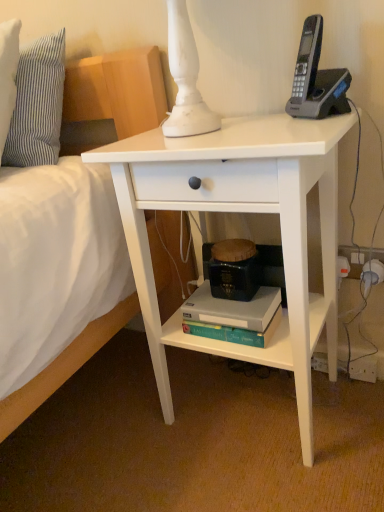
Question: From a real-world perspective, is black plastic phone at upper right under striped fabric pillow at upper left?

Choices:
 (A) no
 (B) yes

Answer: (B)

Question: From the image's perspective, would you say black plastic phone at upper right is positioned over striped fabric pillow at upper left?

Choices:
 (A) no
 (B) yes

Answer: (A)

Question: Is black plastic phone at upper right bigger than striped fabric pillow at upper left?

Choices:
 (A) yes
 (B) no

Answer: (B)

Question: From the image's perspective, is black plastic phone at upper right located beneath striped fabric pillow at upper left?

Choices:
 (A) yes
 (B) no

Answer: (A)

Question: Does black plastic phone at upper right appear on the left side of striped fabric pillow at upper left?

Choices:
 (A) yes
 (B) no

Answer: (B)

Question: Is point (261, 181) closer or farther from the camera than point (41, 133)?

Choices:
 (A) closer
 (B) farther

Answer: (A)

Question: Relative to striped fabric pillow at upper left, is white matte desk at center in front or behind?

Choices:
 (A) behind
 (B) front

Answer: (B)

Question: From a real-world perspective, is white matte desk at center above or below striped fabric pillow at upper left?

Choices:
 (A) below
 (B) above

Answer: (A)

Question: Is white matte desk at center bigger or smaller than striped fabric pillow at upper left?

Choices:
 (A) small
 (B) big

Answer: (B)

Question: Is black plastic phone at upper right in front of or behind teal matte paperback book at lower center in the image?

Choices:
 (A) front
 (B) behind

Answer: (A)

Question: In terms of width, does black plastic phone at upper right look wider or thinner when compared to teal matte paperback book at lower center?

Choices:
 (A) thin
 (B) wide

Answer: (A)

Question: From the image's perspective, relative to teal matte paperback book at lower center, is black plastic phone at upper right above or below?

Choices:
 (A) above
 (B) below

Answer: (A)

Question: From a real-world perspective, relative to teal matte paperback book at lower center, is black plastic phone at upper right vertically above or below?

Choices:
 (A) below
 (B) above

Answer: (B)

Question: Considering the positions of white matte desk at center and teal matte paperback book at lower center in the image, is white matte desk at center taller or shorter than teal matte paperback book at lower center?

Choices:
 (A) short
 (B) tall

Answer: (B)

Question: From a real-world perspective, relative to teal matte paperback book at lower center, is white matte desk at center vertically above or below?

Choices:
 (A) above
 (B) below

Answer: (A)